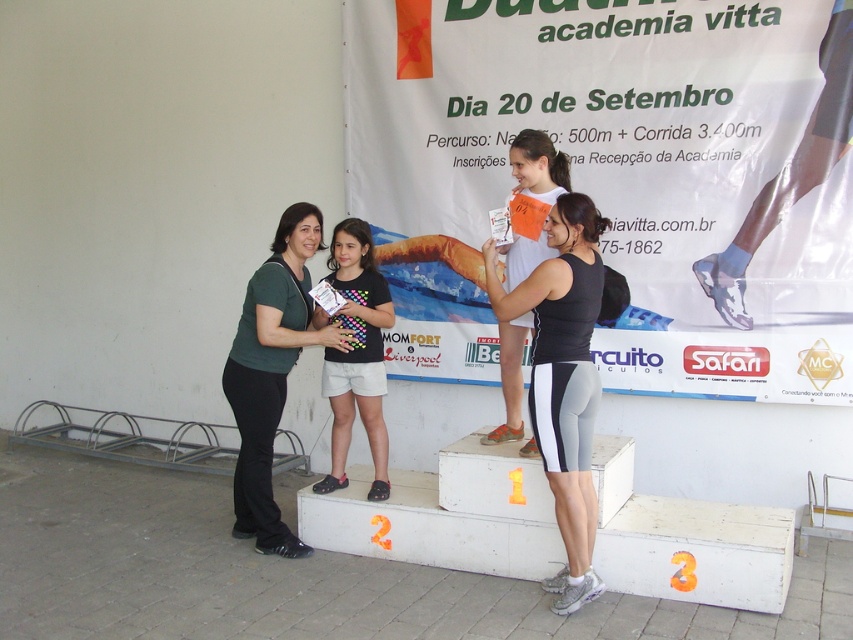
You are a photographer at the event and need to ensure that the green matte shirt at center and the black fabric shirt at center are both visible in your photo. Given that the camera frame can only accommodate items up to the width of the wider shirt, which shirt should you align the camera frame to ensure both are fully visible?

The green matte shirt at center is wider than the black fabric shirt at center. Therefore, align the camera frame to the width of the green matte shirt at center to ensure both shirts are fully visible.

You are a photographer at the event and need to capture a closeup shot of both the green matte shirt at center and the orange paper tag at center. Since your camera can only focus on one object at a time, which object should you focus on first to ensure the larger object is in focus?

The green matte shirt at center is bigger than the orange paper tag at center, so you should focus on the green matte shirt at center first to ensure the larger object is in focus.